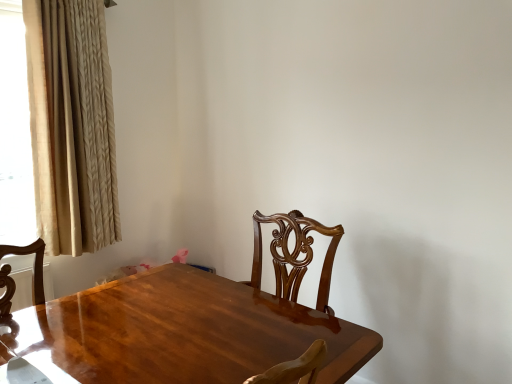
Question: Is beige textured curtain at left in front of or behind glossy wood table at center in the image?

Choices:
 (A) front
 (B) behind

Answer: (B)

Question: Visually, is beige textured curtain at left positioned to the left or to the right of glossy wood table at center?

Choices:
 (A) left
 (B) right

Answer: (A)

Question: In terms of width, does beige textured curtain at left look wider or thinner when compared to glossy wood table at center?

Choices:
 (A) wide
 (B) thin

Answer: (B)

Question: Choose the correct answer: Is glossy wood table at center inside beige textured curtain at left or outside it?

Choices:
 (A) inside
 (B) outside

Answer: (B)

Question: Is point (269, 296) positioned closer to the camera than point (49, 226)?

Choices:
 (A) closer
 (B) farther

Answer: (A)

Question: In the image, is glossy wood table at center positioned in front of or behind beige textured curtain at left?

Choices:
 (A) behind
 (B) front

Answer: (B)

Question: From their relative heights in the image, would you say glossy wood table at center is taller or shorter than beige textured curtain at left?

Choices:
 (A) tall
 (B) short

Answer: (B)